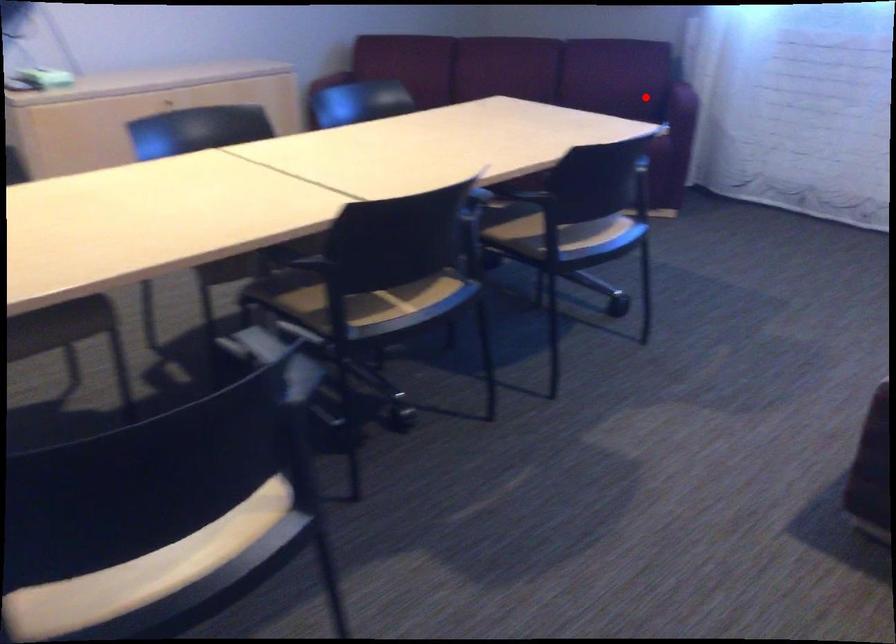
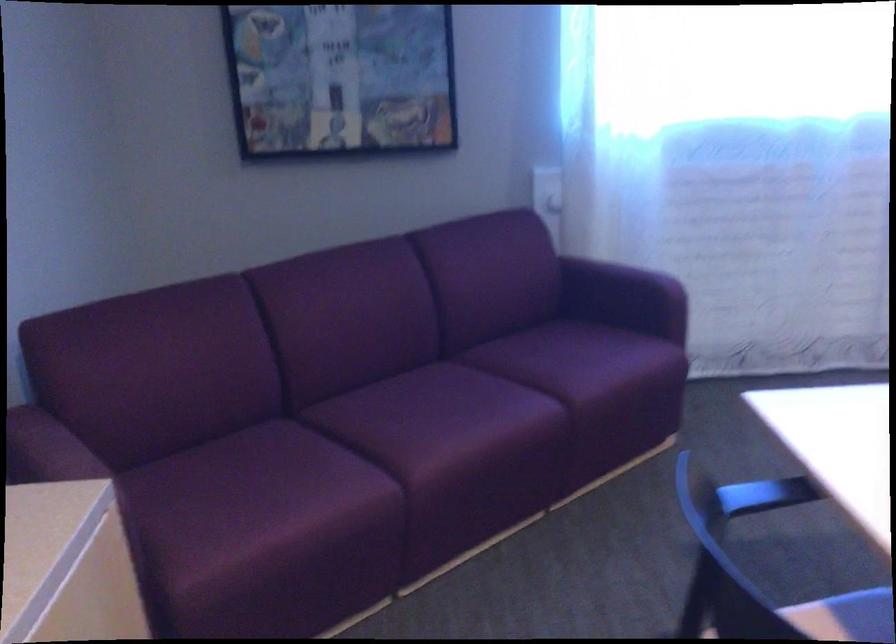
Find the pixel in the second image that matches the highlighted location in the first image.

(617, 289)